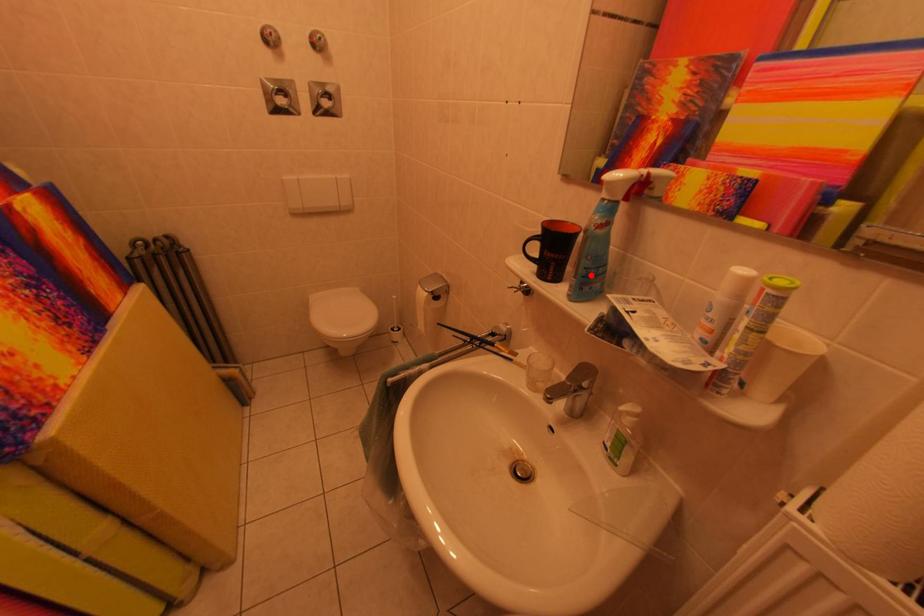
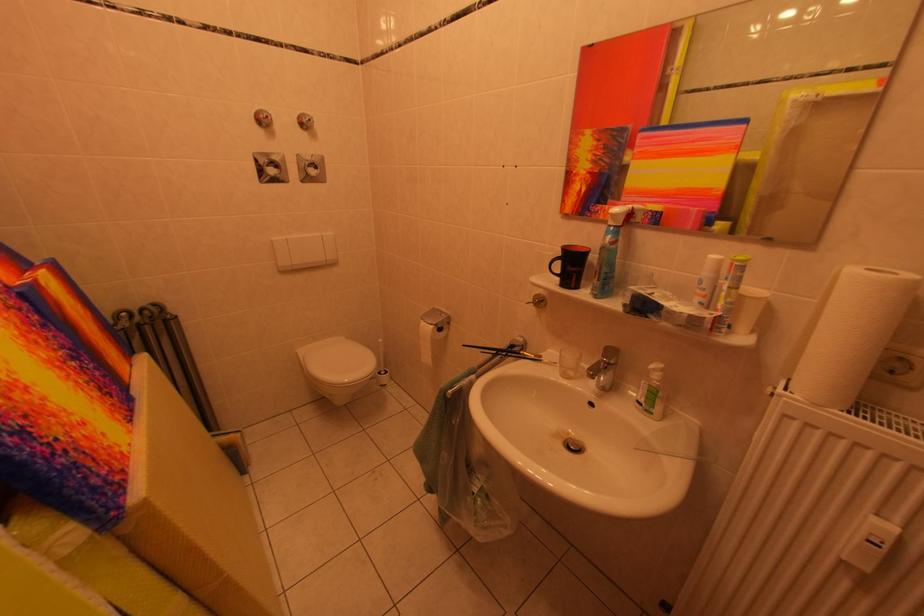
The point at the highlighted location is marked in the first image. Where is the corresponding point in the second image?

(613, 280)